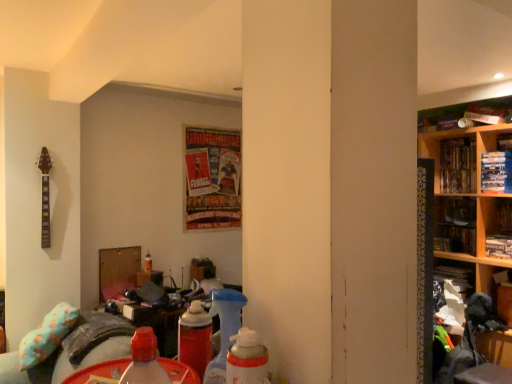
Question: Which direction should I rotate to look at shiny paper poster at center, positioned as the first book in left-to-right order, — up or down?

Choices:
 (A) up
 (B) down

Answer: (A)

Question: Is hardcover books at upper right, the 4th book from the left, smaller than shiny paper poster at center, which ranks as the fifth book in right-to-left order?

Choices:
 (A) no
 (B) yes

Answer: (B)

Question: Considering the relative sizes of hardcover books at upper right, arranged as the 2th book when viewed from the right, and shiny paper poster at center, which ranks as the fifth book in right-to-left order, in the image provided, is hardcover books at upper right, arranged as the 2th book when viewed from the right, thinner than shiny paper poster at center, which ranks as the fifth book in right-to-left order,?

Choices:
 (A) yes
 (B) no

Answer: (B)

Question: Is hardcover books at upper right, the 4th book from the left, at the right side of shiny paper poster at center, positioned as the first book in left-to-right order?

Choices:
 (A) no
 (B) yes

Answer: (B)

Question: Could you tell me if hardcover books at upper right, the 4th book from the left, is facing shiny paper poster at center, positioned as the first book in left-to-right order?

Choices:
 (A) no
 (B) yes

Answer: (A)

Question: From a real-world perspective, is hardcover books at upper right, arranged as the 2th book when viewed from the right, on shiny paper poster at center, positioned as the first book in left-to-right order?

Choices:
 (A) no
 (B) yes

Answer: (B)

Question: Considering the relative sizes of hardcover books at upper right, the 4th book from the left, and shiny paper poster at center, positioned as the first book in left-to-right order, in the image provided, is hardcover books at upper right, the 4th book from the left, taller than shiny paper poster at center, positioned as the first book in left-to-right order,?

Choices:
 (A) yes
 (B) no

Answer: (B)

Question: Is translucent plastic bottle at center, the 1th bottle viewed from the right, to the right of wooden shelves at right from the viewer's perspective?

Choices:
 (A) no
 (B) yes

Answer: (A)

Question: From the image's perspective, is translucent plastic bottle at center, which ranks as the 2th bottle in left-to-right order, on wooden shelves at right?

Choices:
 (A) yes
 (B) no

Answer: (A)

Question: Is translucent plastic bottle at center, which ranks as the 2th bottle in left-to-right order, facing towards wooden shelves at right?

Choices:
 (A) yes
 (B) no

Answer: (B)

Question: Is translucent plastic bottle at center, marked as the second bottle in a back-to-front arrangement, at the left side of wooden shelves at right?

Choices:
 (A) no
 (B) yes

Answer: (B)

Question: Does translucent plastic bottle at center, marked as the 1th bottle in a top-to-bottom arrangement, have a greater height compared to wooden shelves at right?

Choices:
 (A) no
 (B) yes

Answer: (A)

Question: Is wooden shelves at right surrounded by translucent plastic bottle at center, marked as the second bottle in a back-to-front arrangement?

Choices:
 (A) no
 (B) yes

Answer: (A)

Question: Is fluffy teal pillow at lower left positioned beyond the bounds of translucent plastic bottle at center, which is counted as the 1th bottle, starting from the left?

Choices:
 (A) yes
 (B) no

Answer: (A)